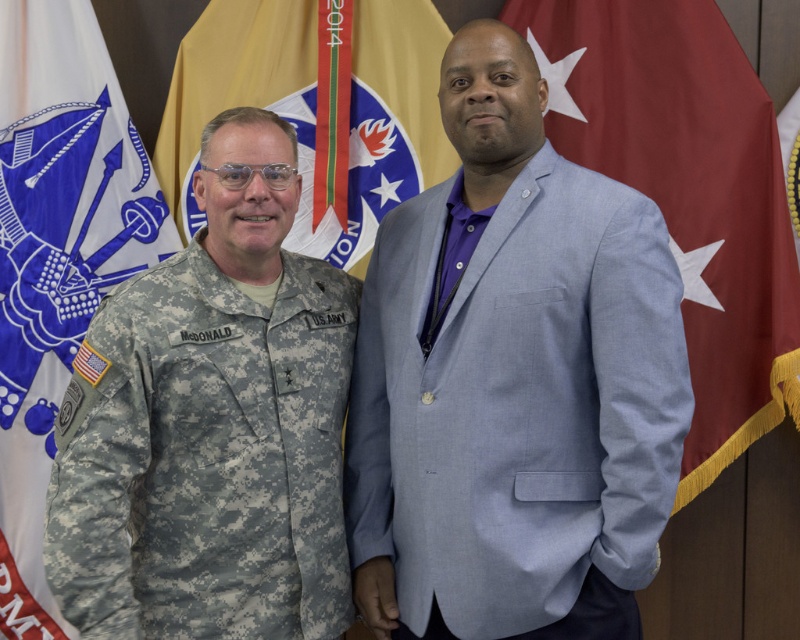
You are a photographer setting up for a group photo. You notice the white fabric flag at left and the gold textured flag at center in the background. Since you want to ensure the flags are visible in the photo, which flag should you focus on first to account for their sizes?

The white fabric flag at left has a greater height compared to the gold textured flag at center, so you should focus on the white fabric flag at left first as it is larger and more prominent.

You are a photographer setting up for a group photo. You need to position a 15 inch wide banner between the white fabric flag at left and the gold textured flag at center. Will there be enough space?

The distance between the white fabric flag at left and the gold textured flag at center is 14.96 inches, which is slightly less than the 15 inch wide banner. Therefore, there is not enough space to fit the banner between them.

You are a photographer planning to take a group photo of the two people in the image. You want to ensure both are framed symmetrically. Given the presence of the red fabric flag at right and the gold textured flag at center, which flag might pose a challenge for symmetry and why?

The red fabric flag at right is bigger than the gold textured flag at center, so it might pose a challenge for symmetry because its larger size could disrupt the balanced composition when framing both individuals equally.